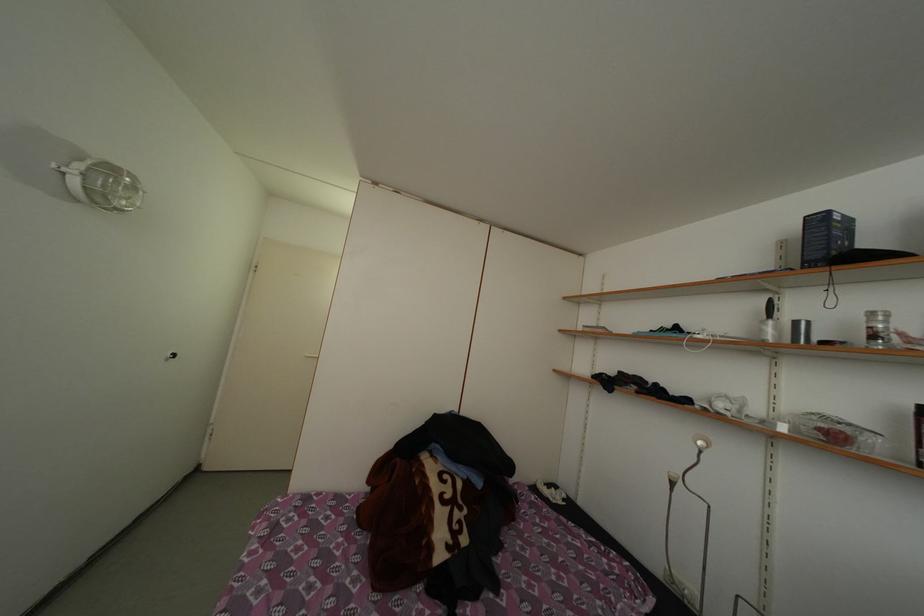
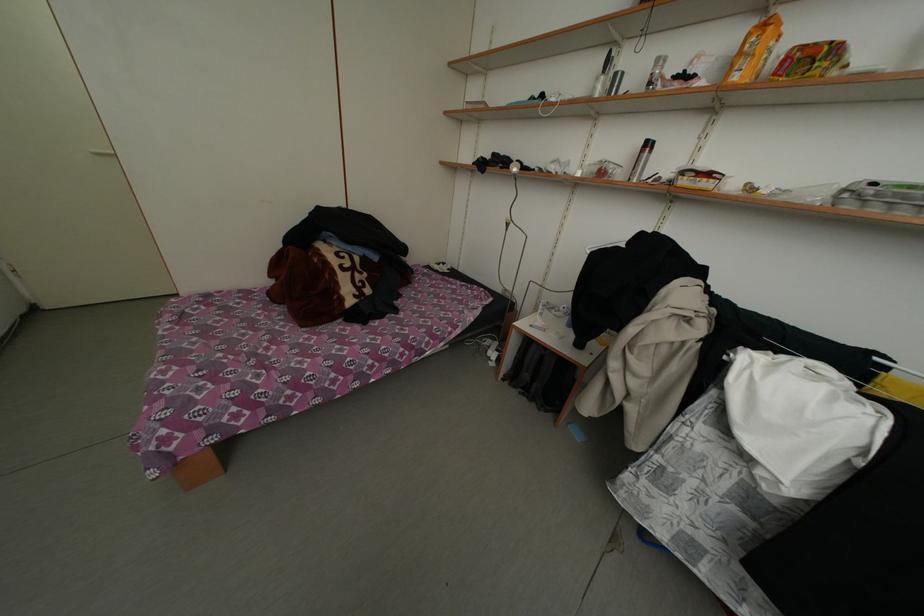
Find the pixel in the second image that matches point (769, 336) in the first image.

(602, 94)